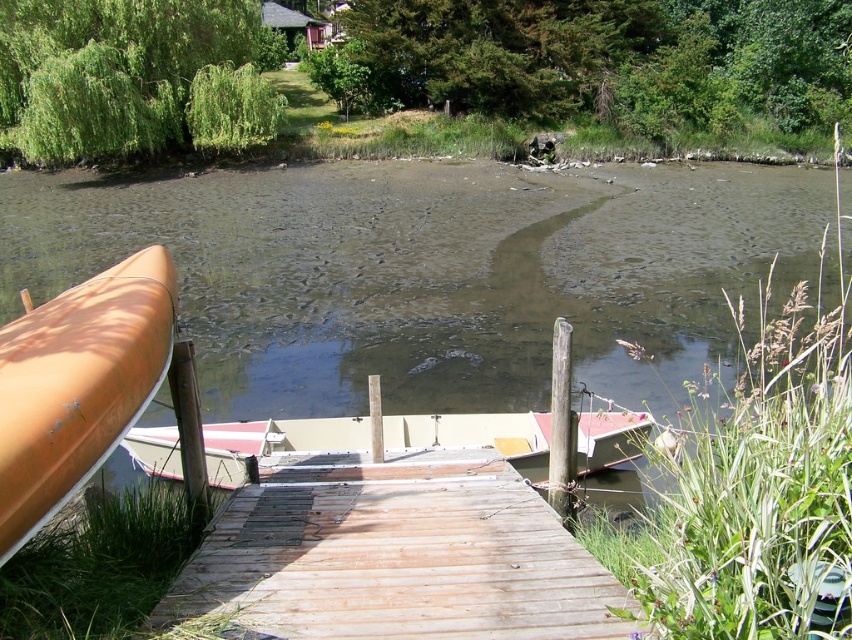
Question: In this image, where is wooden dock at center located relative to matte orange canoe at left?

Choices:
 (A) right
 (B) left

Answer: (A)

Question: Can you confirm if brown murky water at center is positioned below white matte boat at center?

Choices:
 (A) no
 (B) yes

Answer: (A)

Question: Which object is positioned farthest from the wooden dock at center?

Choices:
 (A) brown murky water at center
 (B) matte orange canoe at left
 (C) white matte boat at center

Answer: (A)

Question: Which point appears farthest from the camera in this image?

Choices:
 (A) (442, 564)
 (B) (579, 436)

Answer: (B)

Question: Can you confirm if brown murky water at center is positioned to the right of wooden dock at center?

Choices:
 (A) no
 (B) yes

Answer: (A)

Question: Which of these objects is positioned closest to the matte orange canoe at left?

Choices:
 (A) brown murky water at center
 (B) white matte boat at center

Answer: (B)